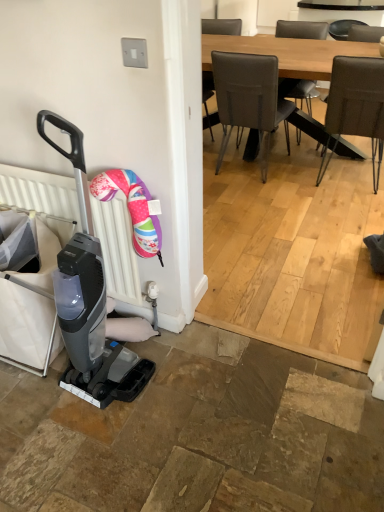
Question: From a real-world perspective, is matte black baby carriage at left on top of light brown wooden table at upper center?

Choices:
 (A) no
 (B) yes

Answer: (B)

Question: Can you confirm if matte black baby carriage at left is taller than light brown wooden table at upper center?

Choices:
 (A) no
 (B) yes

Answer: (B)

Question: Is matte black baby carriage at left not inside light brown wooden table at upper center?

Choices:
 (A) yes
 (B) no

Answer: (A)

Question: From a real-world perspective, is matte black baby carriage at left physically below light brown wooden table at upper center?

Choices:
 (A) no
 (B) yes

Answer: (A)

Question: Is matte black baby carriage at left closer to the viewer compared to light brown wooden table at upper center?

Choices:
 (A) no
 (B) yes

Answer: (B)

Question: From the image's perspective, is leather-like brown chair at upper right above or below light brown wooden table at upper center?

Choices:
 (A) below
 (B) above

Answer: (A)

Question: Considering the positions of leather-like brown chair at upper right and light brown wooden table at upper center in the image, is leather-like brown chair at upper right wider or thinner than light brown wooden table at upper center?

Choices:
 (A) thin
 (B) wide

Answer: (A)

Question: In the image, is leather-like brown chair at upper right positioned in front of or behind light brown wooden table at upper center?

Choices:
 (A) behind
 (B) front

Answer: (B)

Question: Considering the positions of point (372, 110) and point (317, 44), is point (372, 110) closer or farther from the camera than point (317, 44)?

Choices:
 (A) closer
 (B) farther

Answer: (A)

Question: From a real-world perspective, is leather-like brown chair at upper right above or below matte black baby carriage at left?

Choices:
 (A) below
 (B) above

Answer: (A)

Question: Is leather-like brown chair at upper right inside or outside of matte black baby carriage at left?

Choices:
 (A) inside
 (B) outside

Answer: (B)

Question: From the image's perspective, is leather-like brown chair at upper right located above or below matte black baby carriage at left?

Choices:
 (A) below
 (B) above

Answer: (B)

Question: Considering the positions of point (334, 113) and point (61, 310), is point (334, 113) closer or farther from the camera than point (61, 310)?

Choices:
 (A) farther
 (B) closer

Answer: (A)

Question: Looking at the image, does light brown wooden table at upper center seem bigger or smaller compared to leather-like brown chair at upper right?

Choices:
 (A) big
 (B) small

Answer: (A)

Question: From a real-world perspective, is light brown wooden table at upper center positioned above or below leather-like brown chair at upper right?

Choices:
 (A) below
 (B) above

Answer: (A)